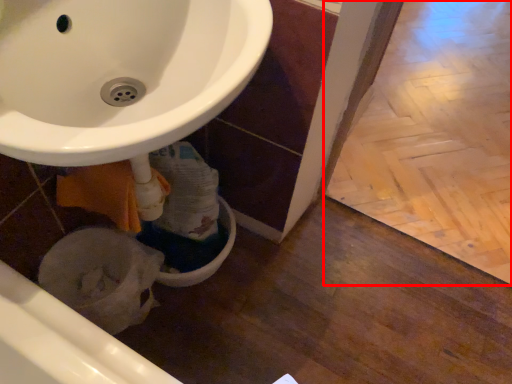
Question: Observing the image, what is the correct spatial positioning of tile (annotated by the red box) in reference to bidet?

Choices:
 (A) left
 (B) right

Answer: (B)